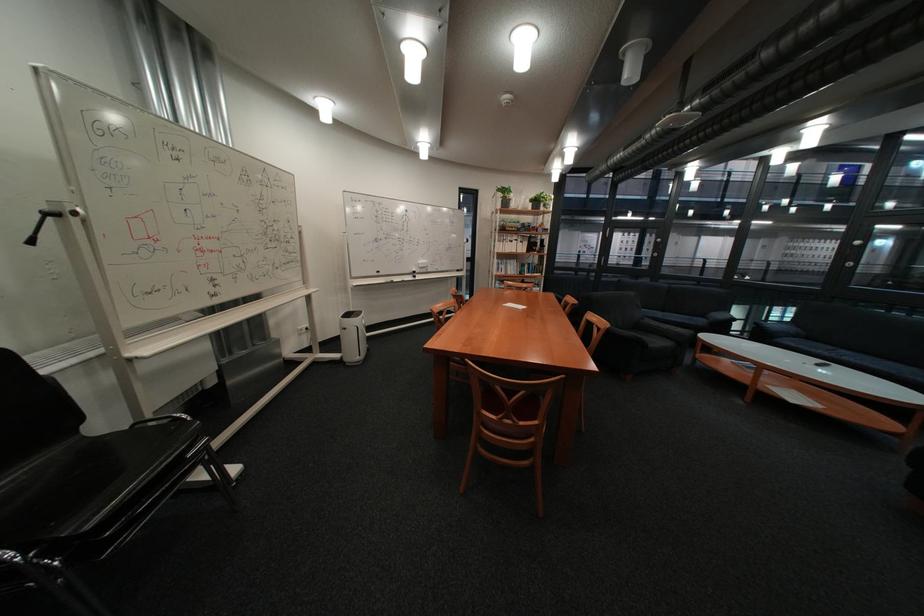
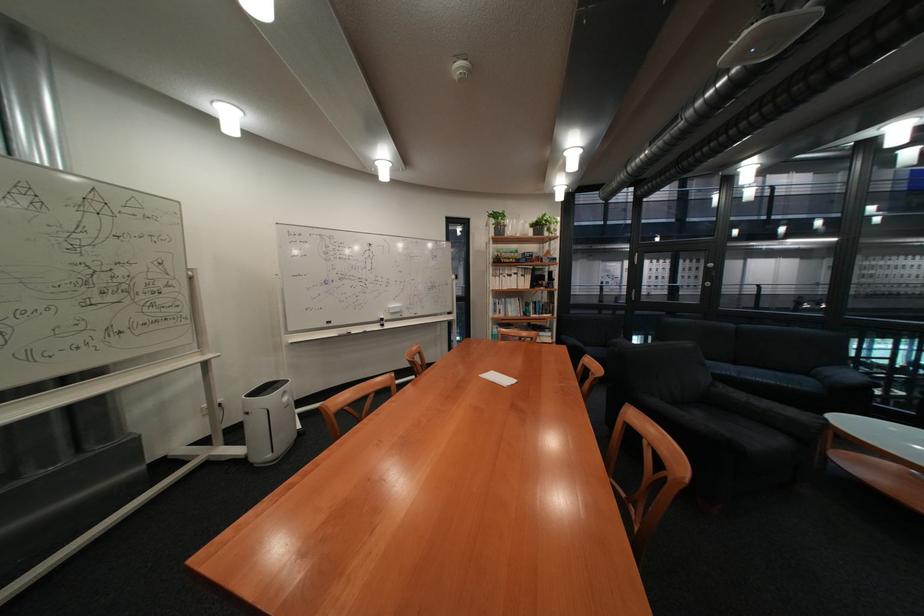
What movement of the cameraman would produce the second image?

The cameraman walked toward right, forward.